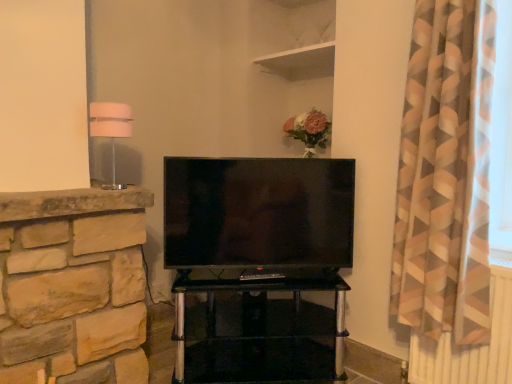
Question: Can we say white fabric lampshade at left lies outside transparent glass tv stand at center?

Choices:
 (A) yes
 (B) no

Answer: (A)

Question: Does white fabric lampshade at left appear on the left side of transparent glass tv stand at center?

Choices:
 (A) no
 (B) yes

Answer: (B)

Question: Is white fabric lampshade at left aimed at transparent glass tv stand at center?

Choices:
 (A) no
 (B) yes

Answer: (A)

Question: From the image's perspective, is white fabric lampshade at left beneath transparent glass tv stand at center?

Choices:
 (A) no
 (B) yes

Answer: (A)

Question: Does white fabric lampshade at left have a larger size compared to transparent glass tv stand at center?

Choices:
 (A) yes
 (B) no

Answer: (B)

Question: Is transparent glass tv stand at center inside white fabric lampshade at left?

Choices:
 (A) yes
 (B) no

Answer: (B)

Question: Is white fabric lampshade at left surrounded by matte black tv at center?

Choices:
 (A) no
 (B) yes

Answer: (A)

Question: Can you confirm if matte black tv at center is positioned to the right of white fabric lampshade at left?

Choices:
 (A) yes
 (B) no

Answer: (A)

Question: Is matte black tv at center shorter than white fabric lampshade at left?

Choices:
 (A) no
 (B) yes

Answer: (A)

Question: Can you confirm if matte black tv at center is taller than white fabric lampshade at left?

Choices:
 (A) no
 (B) yes

Answer: (B)

Question: From the image's perspective, is matte black tv at center on white fabric lampshade at left?

Choices:
 (A) no
 (B) yes

Answer: (A)

Question: From the image's perspective, does matte black tv at center appear lower than white fabric lampshade at left?

Choices:
 (A) yes
 (B) no

Answer: (A)

Question: Does white fabric lampshade at left have a greater width compared to matte black tv at center?

Choices:
 (A) yes
 (B) no

Answer: (A)